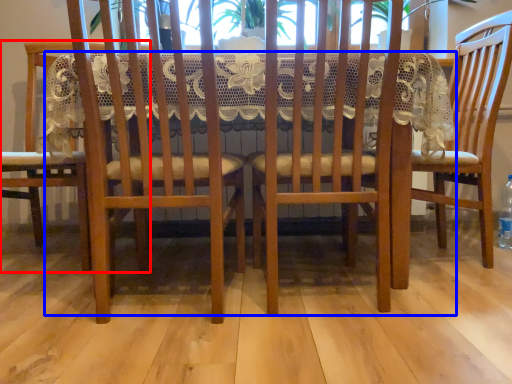
Question: Which object is further to the camera taking this photo, chair (highlighted by a red box) or table (highlighted by a blue box)?

Choices:
 (A) chair
 (B) table

Answer: (A)